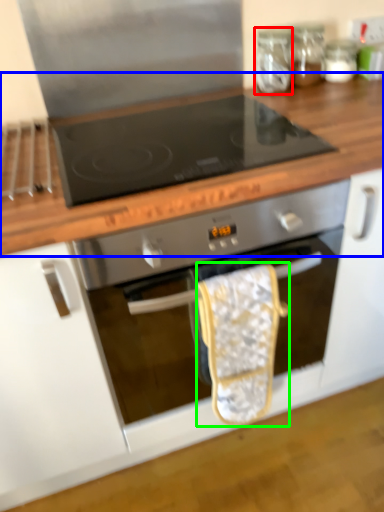
Question: Which is nearer to the glass jar (highlighted by a red box)? countertop (highlighted by a blue box) or material (highlighted by a green box).

Choices:
 (A) countertop
 (B) material

Answer: (A)